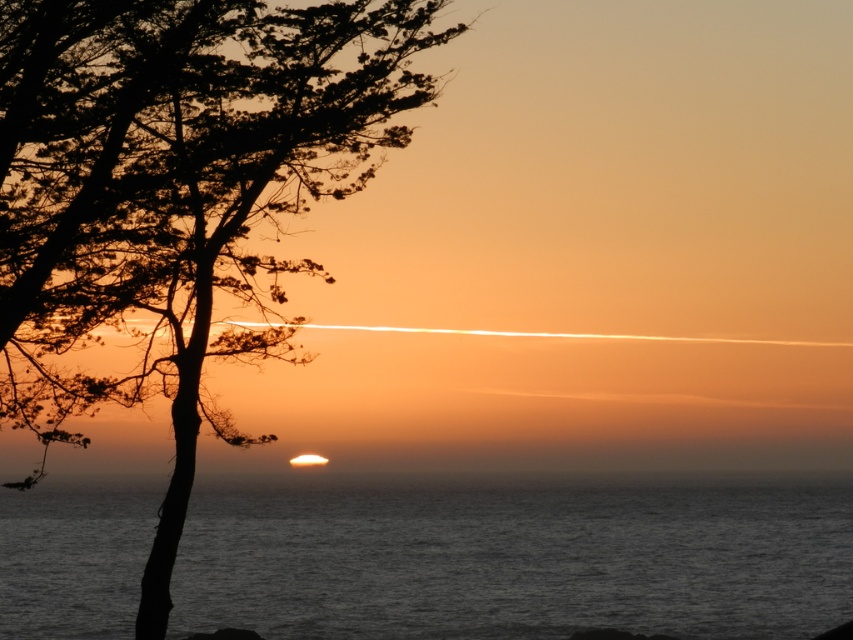
Can you confirm if silhouette wood at left is positioned above dark gray water at center?

Indeed, silhouette wood at left is positioned over dark gray water at center.

Can you confirm if silhouette wood at left is wider than dark gray water at center?

Incorrect, silhouette wood at left's width does not surpass dark gray water at center's.

Who is more distant from viewer, (424, 99) or (630, 560)?

Positioned behind is point (630, 560).

The height and width of the screenshot is (640, 853). In order to click on silhouette wood at left in this screenshot , I will do `click(173, 195)`.